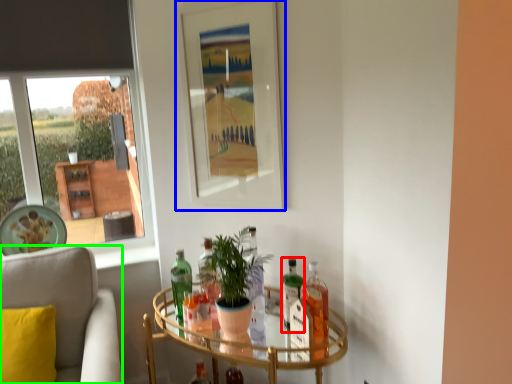
Question: Based on their relative distances, which object is farther from bottle (highlighted by a red box)? Choose from picture frame (highlighted by a blue box) and chair (highlighted by a green box).

Choices:
 (A) picture frame
 (B) chair

Answer: (B)